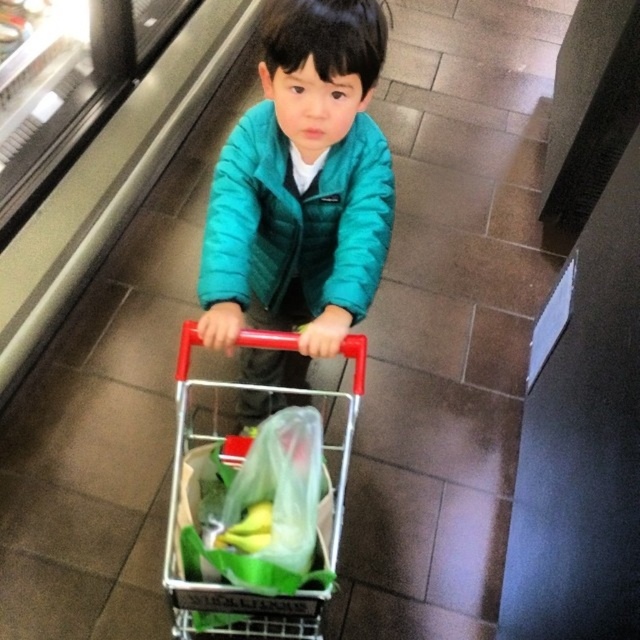
Question: Which object appears closest to the camera in this image?

Choices:
 (A) metallic red trolley at center
 (B) translucent plastic bag at center
 (C) teal quilted jacket at center

Answer: (B)

Question: Among these points, which one is farthest from the camera?

Choices:
 (A) (268, 467)
 (B) (248, 156)

Answer: (B)

Question: Does teal quilted jacket at center lie in front of metallic red trolley at center?

Choices:
 (A) yes
 (B) no

Answer: (B)

Question: Can you confirm if teal quilted jacket at center is wider than translucent plastic bag at center?

Choices:
 (A) yes
 (B) no

Answer: (A)

Question: Does teal quilted jacket at center appear on the right side of metallic red trolley at center?

Choices:
 (A) yes
 (B) no

Answer: (A)

Question: Which object appears closest to the camera in this image?

Choices:
 (A) metallic red trolley at center
 (B) teal quilted jacket at center

Answer: (A)